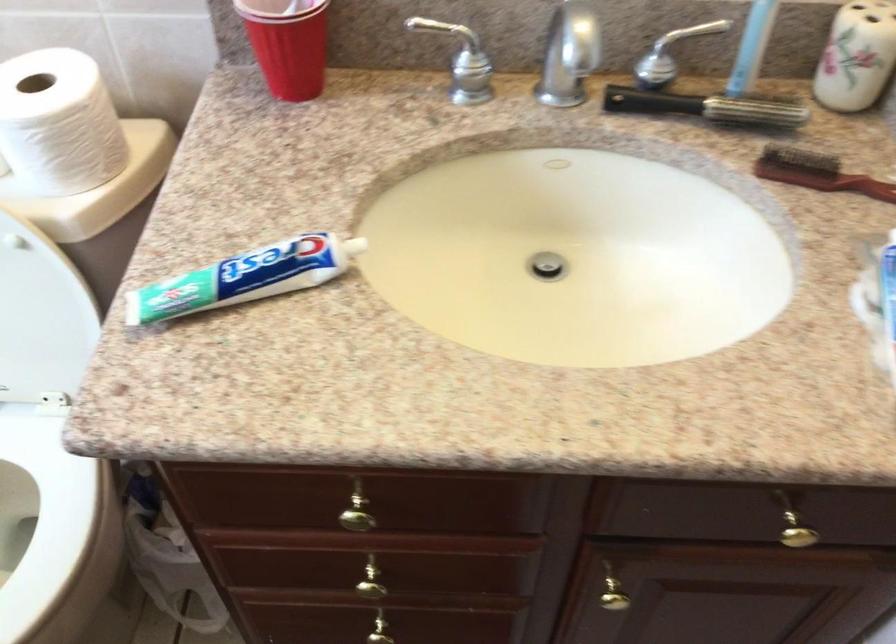
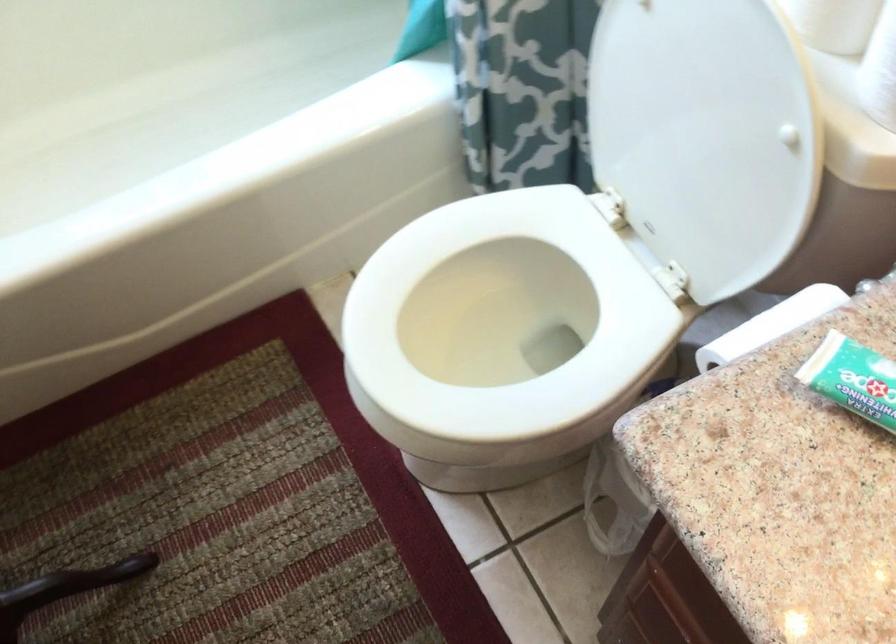
Locate, in the second image, the point that corresponds to pixel 144 301 in the first image.

(853, 379)